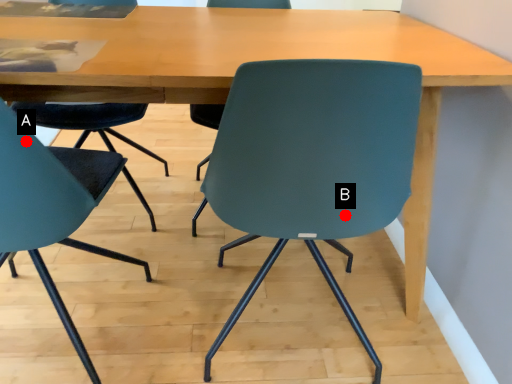
Question: Two points are circled on the image, labeled by A and B beside each circle. Which point is further to the camera?

Choices:
 (A) A is further
 (B) B is further

Answer: (B)